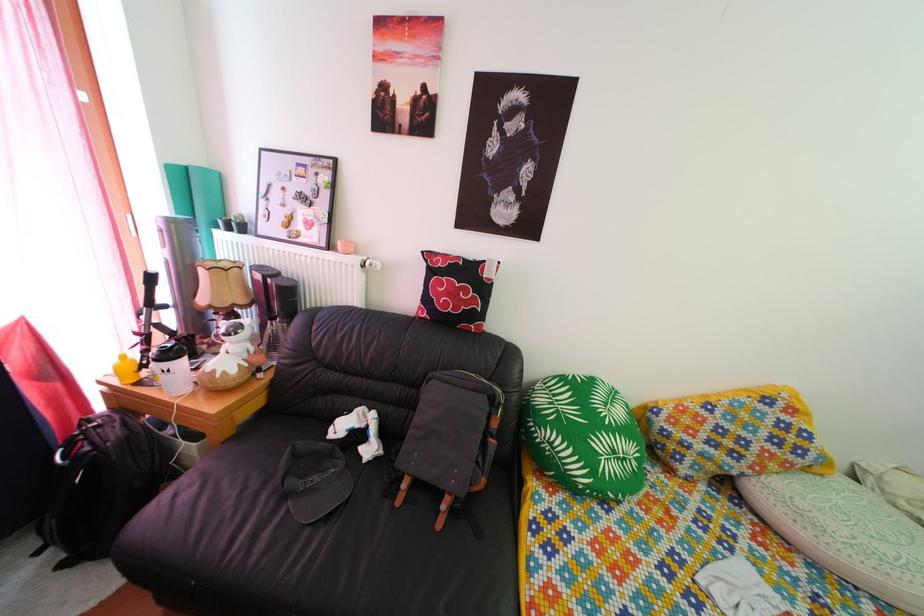
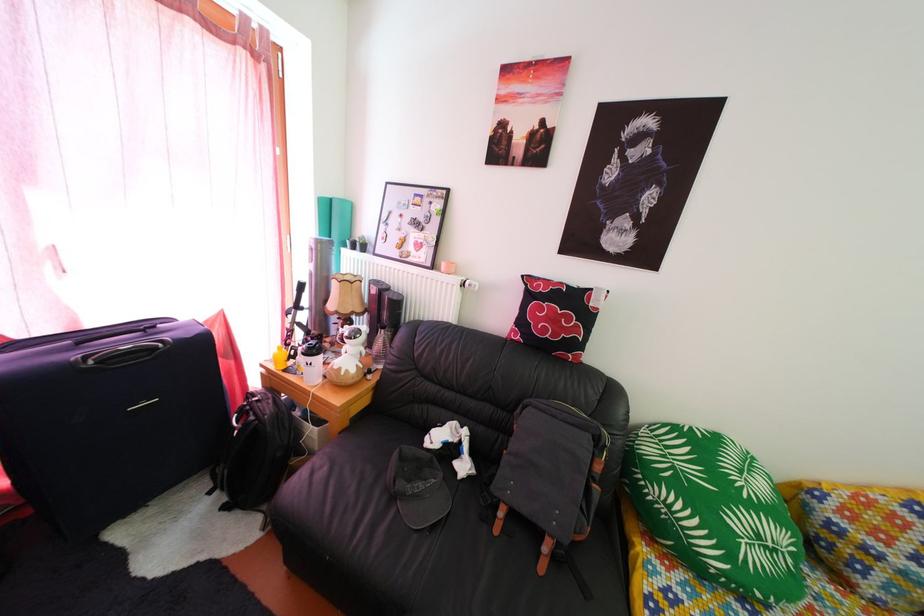
Locate, in the second image, the point that corresponds to (x=176, y=363) in the first image.

(321, 360)